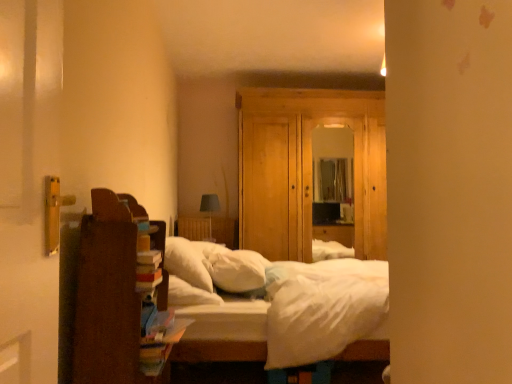
Question: From the image's perspective, is white soft bed at center above white soft pillow at center, which is the first pillow from right to left?

Choices:
 (A) yes
 (B) no

Answer: (B)

Question: Is white soft bed at center thinner than white soft pillow at center, which is the 2th pillow from left to right?

Choices:
 (A) yes
 (B) no

Answer: (B)

Question: Is white soft bed at center wider than white soft pillow at center, which is the first pillow from right to left?

Choices:
 (A) yes
 (B) no

Answer: (A)

Question: Is white soft bed at center to the right of white soft pillow at center, which is the 2th pillow from left to right, from the viewer's perspective?

Choices:
 (A) yes
 (B) no

Answer: (A)

Question: Is white soft bed at center bigger than white soft pillow at center, which is the 2th pillow from left to right?

Choices:
 (A) no
 (B) yes

Answer: (B)

Question: Would you say white soft bed at center is outside white soft pillow at center, which is the first pillow from right to left?

Choices:
 (A) yes
 (B) no

Answer: (A)

Question: Is white soft bed at center positioned in front of brown wooden bookshelf at left?

Choices:
 (A) no
 (B) yes

Answer: (A)

Question: Is white soft bed at center wider than brown wooden bookshelf at left?

Choices:
 (A) yes
 (B) no

Answer: (A)

Question: Is white soft bed at center oriented away from brown wooden bookshelf at left?

Choices:
 (A) no
 (B) yes

Answer: (A)

Question: Is white soft bed at center in contact with brown wooden bookshelf at left?

Choices:
 (A) yes
 (B) no

Answer: (B)

Question: Could you tell me if white soft bed at center is turned towards brown wooden bookshelf at left?

Choices:
 (A) no
 (B) yes

Answer: (A)

Question: Is white soft bed at center completely or partially outside of brown wooden bookshelf at left?

Choices:
 (A) no
 (B) yes

Answer: (B)

Question: Considering the relative sizes of white soft pillow at center, which is the first pillow from right to left, and brown wooden bookshelf at left in the image provided, is white soft pillow at center, which is the first pillow from right to left, smaller than brown wooden bookshelf at left?

Choices:
 (A) yes
 (B) no

Answer: (A)